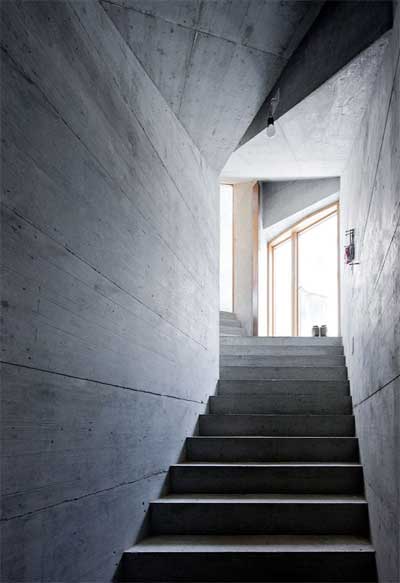
Identify the location of wall on left. (136, 280).